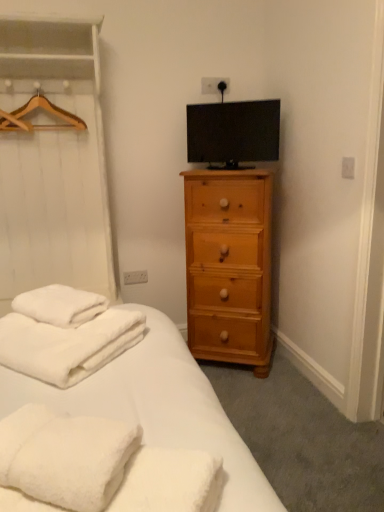
Question: From the image's perspective, is light brown wood chest of drawers at right positioned above or below white fluffy towels at lower left?

Choices:
 (A) above
 (B) below

Answer: (A)

Question: Is point (230, 337) positioned closer to the camera than point (127, 333)?

Choices:
 (A) farther
 (B) closer

Answer: (A)

Question: Which object is the farthest from the light brown wood chest of drawers at right?

Choices:
 (A) white fluffy towels at lower left
 (B) matte black tv at upper center
 (C) wooden hanger at upper left

Answer: (A)

Question: Which object is the closest to the wooden hanger at upper left?

Choices:
 (A) matte black tv at upper center
 (B) light brown wood chest of drawers at right
 (C) white fluffy towels at lower left

Answer: (A)